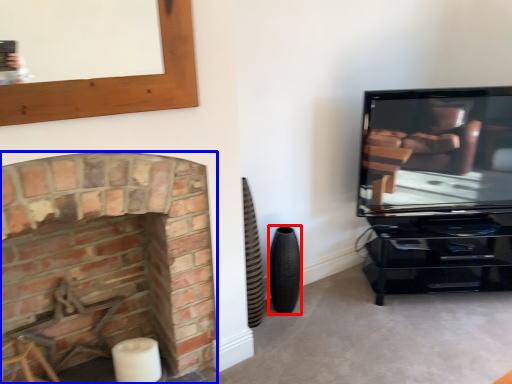
Question: Which object is closer to the camera taking this photo, speaker (highlighted by a red box) or fireplace (highlighted by a blue box)?

Choices:
 (A) speaker
 (B) fireplace

Answer: (B)